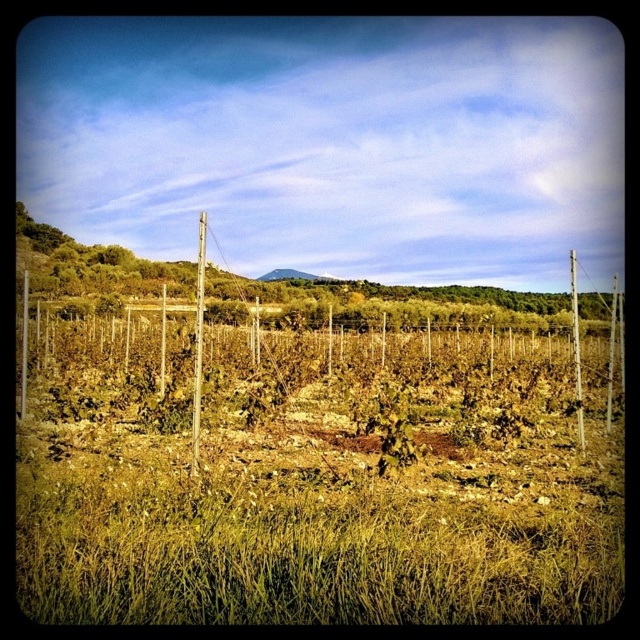
You are a farmer planning to install a new irrigation pipe that needs to span the gap between the smooth wood pole at center and the smooth wooden pole at right. The pipe must be at least 80 feet long to ensure proper coverage. Based on the scene, will the pipe be sufficient in length?

The distance between the smooth wood pole at center and the smooth wooden pole at right is 82.92 feet, so the 80 feet irrigation pipe will be sufficient in length since it meets the minimum requirement.

From the picture: You are a gardener working in the vineyard. You notice the green leafy weed at center and the smooth wooden pole at right. Which object is closer to the ground?

The green leafy weed at center is positioned under the smooth wooden pole at right, so it is closer to the ground.